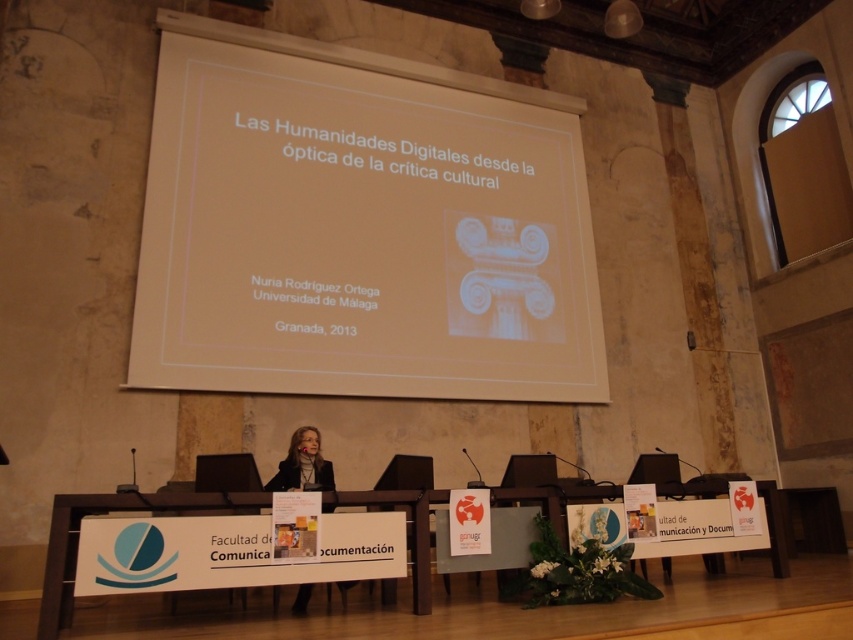
In the scene shown: You are an attendee at this presentation and you want to place a notebook on the white paper at upper center and the white wood table at center. Which surface will allow you to have more space for writing?

The white wood table at center is larger than the white paper at upper center, so it will provide more space for writing.

You are an attendee at this presentation and you want to take notes. You see the white paper at upper center and the matte black suit at center. Which object is smaller in size?

The white paper at upper center occupies less space than the matte black suit at center, so the white paper at upper center is smaller in size.

What is located at the point marked by the coordinates (360, 227) in the image?

The point marked by the coordinates (360, 227) is where the white paper at upper center is located.